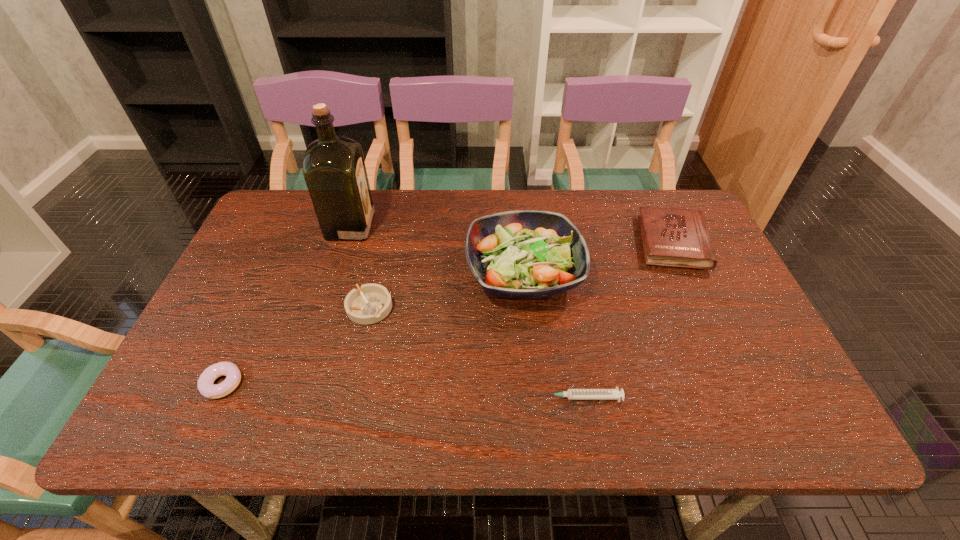
You are a GUI agent. You are given a task and a screenshot of the screen. Output one action in this format:
    pyautogui.click(x=<x>, y=<y>)
    Task: Click on the liquor
    The image size is (960, 540).
    Given the screenshot: What is the action you would take?
    pyautogui.click(x=334, y=170)

You are a GUI agent. You are given a task and a screenshot of the screen. Output one action in this format:
    pyautogui.click(x=<x>, y=<y>)
    Task: Click on the salad plate
    
    Given the screenshot: What is the action you would take?
    pyautogui.click(x=522, y=254)

Where is `the third tallest object`? The height and width of the screenshot is (540, 960). the third tallest object is located at coordinates (675, 237).

This screenshot has height=540, width=960. In order to click on the rightmost object in this screenshot , I will do `click(675, 237)`.

Identify the location of ashtray. (370, 303).

Locate an element on the screen. doughnut is located at coordinates (205, 385).

The image size is (960, 540). In order to click on the shortest object in this screenshot , I will do `click(572, 394)`.

Find the location of a particular element. free region located 0.070m on the label of the liquor is located at coordinates (396, 226).

Locate an element on the screen. The image size is (960, 540). vacant region located on the back of the salad plate is located at coordinates (518, 222).

Find the location of a particular element. blank space located on the front of the rightmost object is located at coordinates (714, 334).